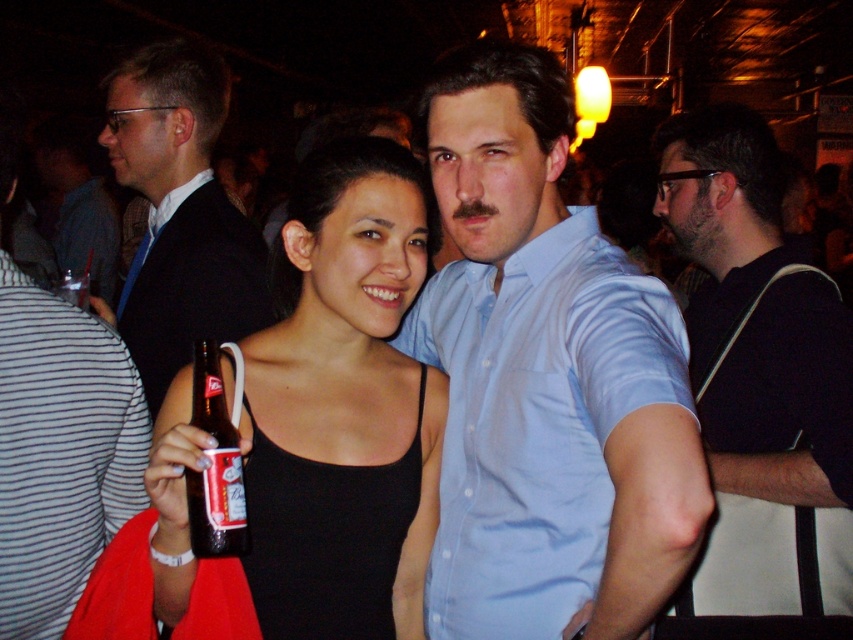
What is the color of the shirt worn by the person at the point with coordinates [61,451]?

The striped fabric shirt at left is the color indicated by the coordinates [61,451].

You are a photographer at the party and want to take a picture of the striped fabric shirt at left and the brown glass bottle at center. Based on their sizes, which one should you focus on to ensure both are in frame without cropping?

The striped fabric shirt at left is taller than the brown glass bottle at center, so focusing on the shirt will ensure both fit without cropping.